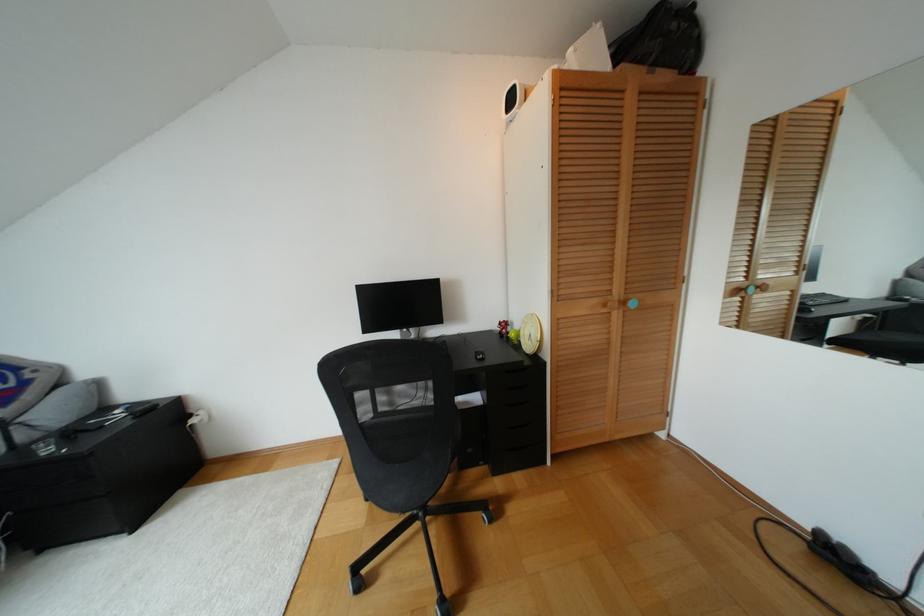
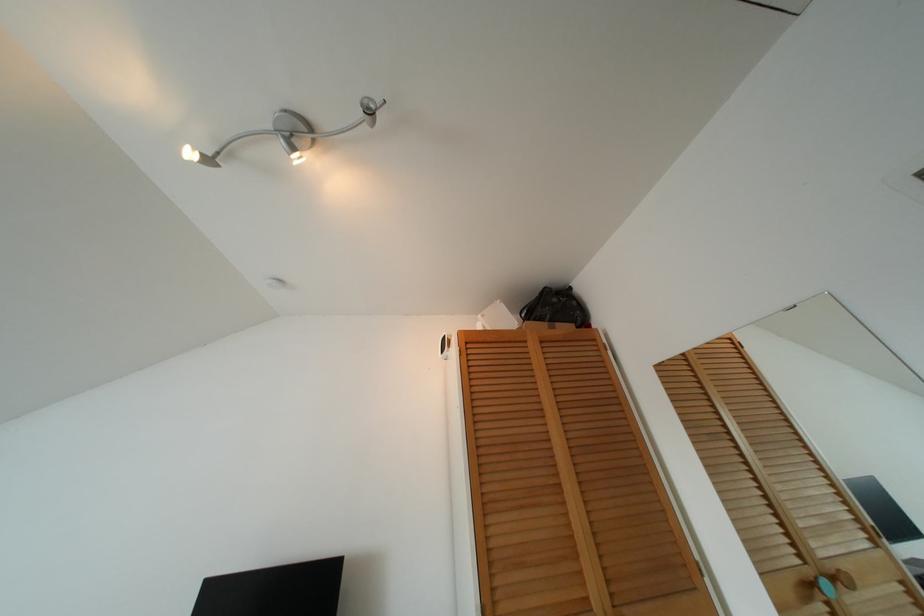
In the second image, find the point that corresponds to [750,288] in the first image.

(825, 585)